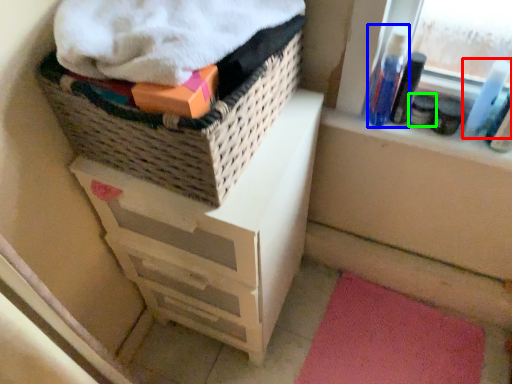
Question: Considering the real-world distances, which object is farthest from mouthwash (highlighted by a red box)? mouthwash (highlighted by a blue box) or toiletry (highlighted by a green box)?

Choices:
 (A) mouthwash
 (B) toiletry

Answer: (A)